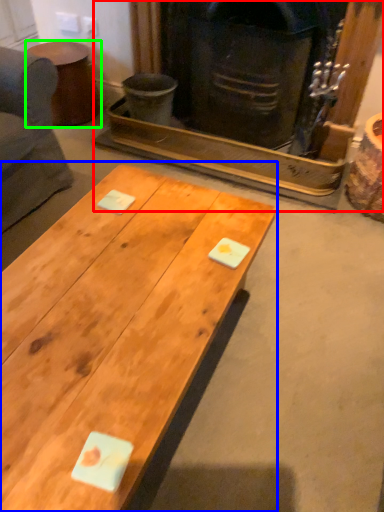
Question: Which object is positioned farthest from fireplace (highlighted by a red box)? Select from coffee table (highlighted by a blue box) and side table (highlighted by a green box).

Choices:
 (A) coffee table
 (B) side table

Answer: (A)